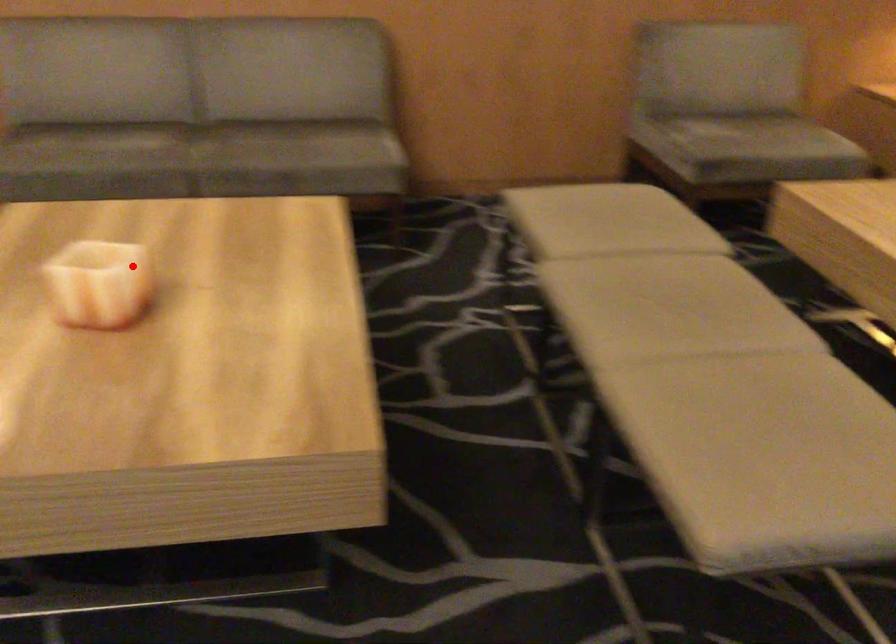
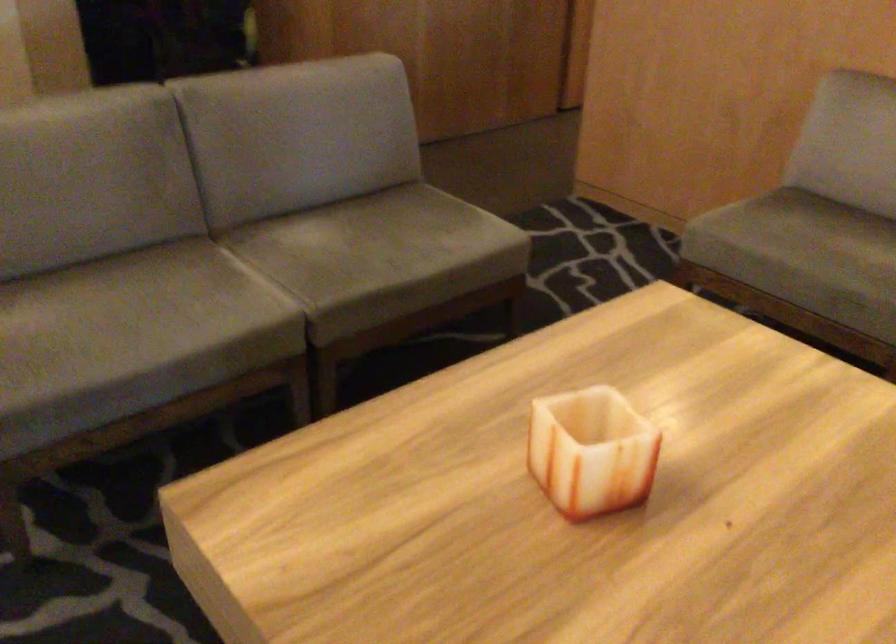
In the second image, find the point that corresponds to the highlighted location in the first image.

(590, 451)